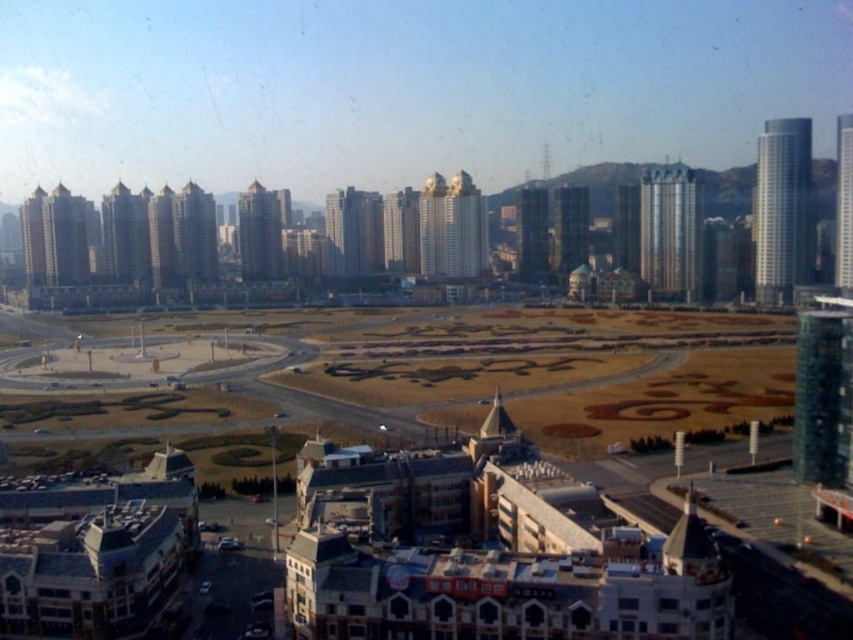
You are standing in the urban landscape and want to walk from point A to point B. Point A is at coordinate point point (695, 244) and point B is at coordinate point point (56, 211). Which point is closer to you when you start at point A?

Point A at coordinate point (695, 244) is closer to you since you are already at point A. To reach point B at coordinate point (56, 211), you need to move towards it from your current position.

You are an architect evaluating the urban layout. You notice the green marble tower at right and the smooth glass skyscraper at right. Which of these two structures has a greater height?

The green marble tower at right is bigger than the smooth glass skyscraper at right, so it has a greater height.

You are an architect analyzing the urban layout. Given the gold reflective building at center and the smooth glass skyscraper at right, which one has a greater height?

The smooth glass skyscraper at right is taller than the gold reflective building at center.